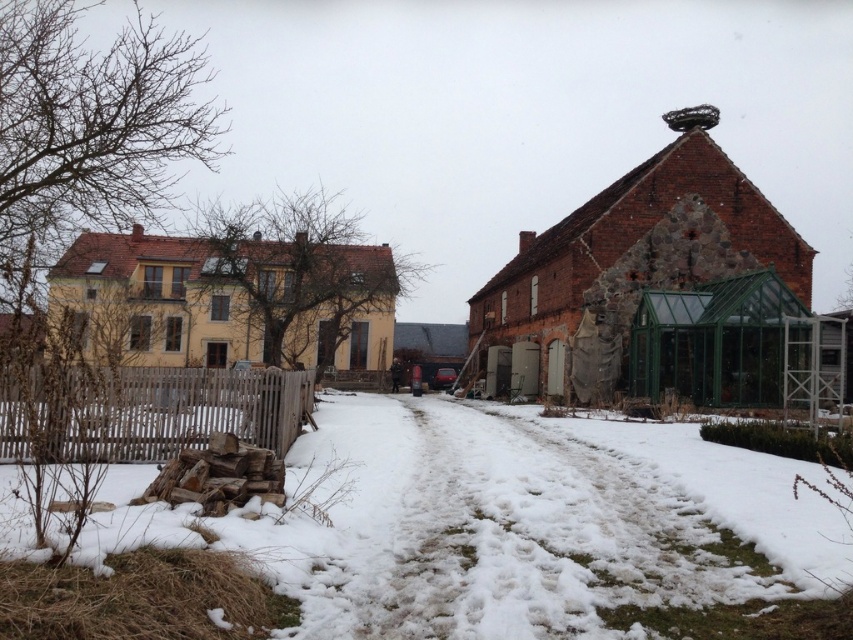
Question: Which object appears closest to the camera in this image?

Choices:
 (A) wooden picket fence at lower left
 (B) white fluffy snow at lower left

Answer: (B)

Question: Is white fluffy snow at lower left above wooden picket fence at lower left?

Choices:
 (A) yes
 (B) no

Answer: (B)

Question: Which point is farther to the camera?

Choices:
 (A) (39, 420)
 (B) (575, 483)

Answer: (B)

Question: Can you confirm if white fluffy snow at lower left is positioned below wooden picket fence at lower left?

Choices:
 (A) yes
 (B) no

Answer: (A)

Question: Is white fluffy snow at lower left positioned before wooden picket fence at lower left?

Choices:
 (A) no
 (B) yes

Answer: (B)